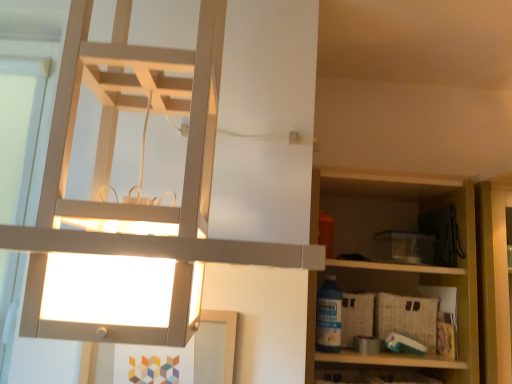
Question: From the image's perspective, is woven beige crate at lower right located beneath matte white lamp at upper left?

Choices:
 (A) yes
 (B) no

Answer: (A)

Question: From a real-world perspective, does woven beige crate at lower right stand above matte white lamp at upper left?

Choices:
 (A) yes
 (B) no

Answer: (B)

Question: Would you consider woven beige crate at lower right to be distant from matte white lamp at upper left?

Choices:
 (A) yes
 (B) no

Answer: (A)

Question: From a real-world perspective, is woven beige crate at lower right below matte white lamp at upper left?

Choices:
 (A) no
 (B) yes

Answer: (B)

Question: Is woven beige crate at lower right not within matte white lamp at upper left?

Choices:
 (A) no
 (B) yes

Answer: (B)

Question: Which is correct: matte white lamp at upper left is inside woven beige crate at lower right, or outside of it?

Choices:
 (A) outside
 (B) inside

Answer: (A)

Question: Considering the positions of matte white lamp at upper left and woven beige crate at lower right in the image, is matte white lamp at upper left wider or thinner than woven beige crate at lower right?

Choices:
 (A) wide
 (B) thin

Answer: (A)

Question: From the image's perspective, relative to woven beige crate at lower right, is matte white lamp at upper left above or below?

Choices:
 (A) above
 (B) below

Answer: (A)

Question: In terms of height, does matte white lamp at upper left look taller or shorter compared to woven beige crate at lower right?

Choices:
 (A) tall
 (B) short

Answer: (A)

Question: From a real-world perspective, is matte white lamp at upper left above or below wooden shelf at right?

Choices:
 (A) below
 (B) above

Answer: (B)

Question: Is point (100, 89) closer or farther from the camera than point (439, 377)?

Choices:
 (A) closer
 (B) farther

Answer: (A)

Question: Considering the positions of matte white lamp at upper left and wooden shelf at right in the image, is matte white lamp at upper left taller or shorter than wooden shelf at right?

Choices:
 (A) tall
 (B) short

Answer: (A)

Question: Which is correct: matte white lamp at upper left is inside wooden shelf at right, or outside of it?

Choices:
 (A) outside
 (B) inside

Answer: (A)

Question: Looking at their shapes, would you say woven beige crate at lower right is wider or thinner than matte white lamp at upper left?

Choices:
 (A) wide
 (B) thin

Answer: (B)

Question: Is woven beige crate at lower right inside the boundaries of matte white lamp at upper left, or outside?

Choices:
 (A) inside
 (B) outside

Answer: (B)